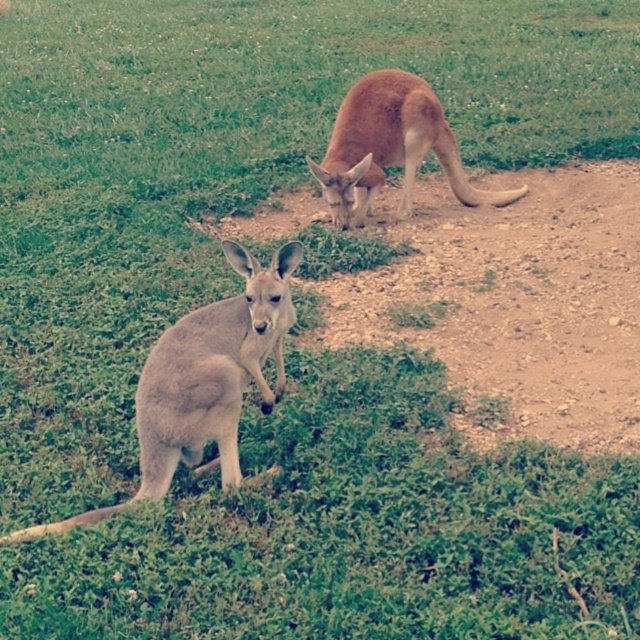
Between point (250, 355) and point (412, 140), which one is positioned behind?

The point (412, 140) is more distant.

Is point (177, 404) farther from camera compared to point (426, 88)?

That is False.

You are a GUI agent. You are given a task and a screenshot of the screen. Output one action in this format:
    pyautogui.click(x=<x>, y=<y>)
    Task: Click on the light brown fur kangaroo at lower left
    This screenshot has width=640, height=640.
    Given the screenshot: What is the action you would take?
    pyautogui.click(x=204, y=381)